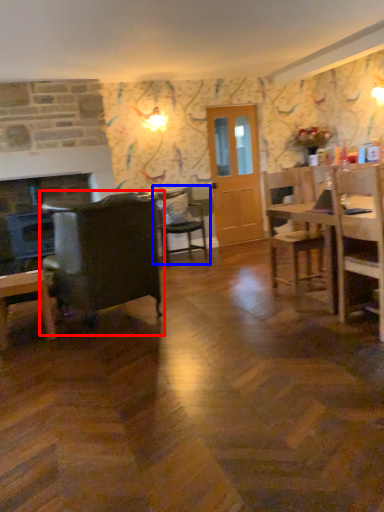
Question: Among these objects, which one is farthest to the camera, chair (highlighted by a red box) or chair (highlighted by a blue box)?

Choices:
 (A) chair
 (B) chair

Answer: (B)